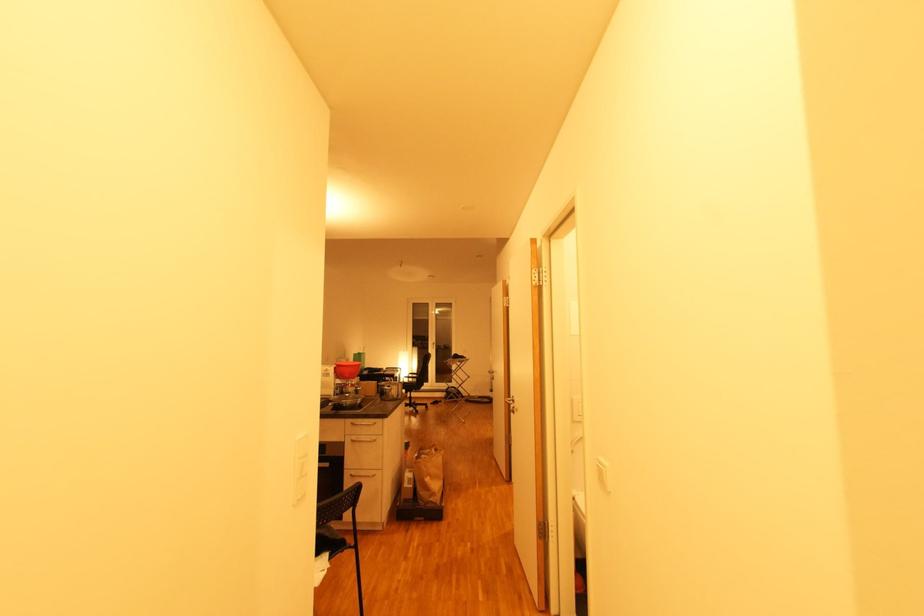
At what (x,y) coordinates should I click in order to perform the action: click on faucet handle. Please return your answer as a coordinate pair (x, y). The height and width of the screenshot is (616, 924). Looking at the image, I should click on (346, 387).